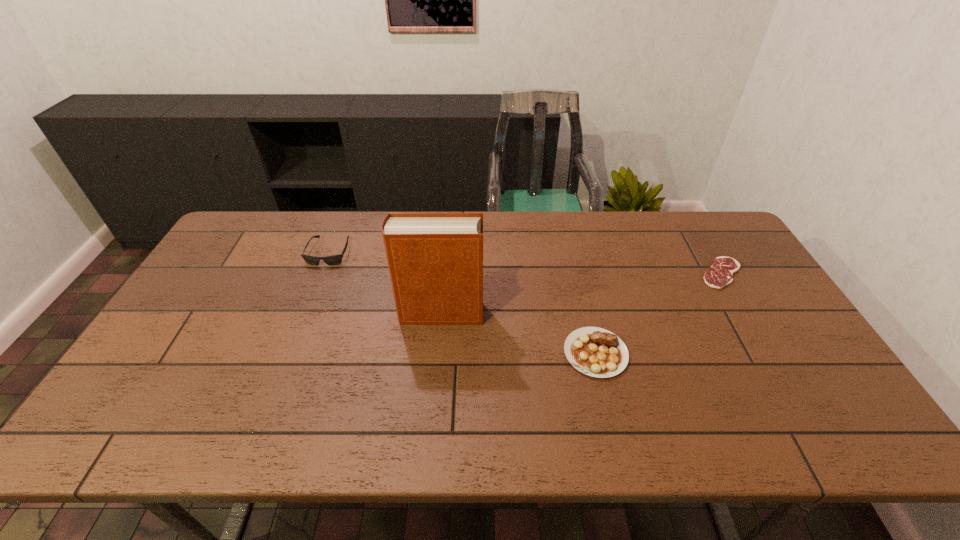
Find the location of a particular element. The height and width of the screenshot is (540, 960). free space located 0.100m on the front of the taller steak is located at coordinates (611, 417).

You are a GUI agent. You are given a task and a screenshot of the screen. Output one action in this format:
    pyautogui.click(x=<x>, y=<y>)
    Task: Click on the vacant area located 0.070m on the back of the shorter steak
    
    Given the screenshot: What is the action you would take?
    pyautogui.click(x=705, y=245)

You are a GUI agent. You are given a task and a screenshot of the screen. Output one action in this format:
    pyautogui.click(x=<x>, y=<y>)
    Task: Click on the object that is at the far edge
    Image resolution: width=960 pixels, height=540 pixels.
    Given the screenshot: What is the action you would take?
    (x=334, y=259)

Identify the location of object located in the right edge section of the desktop. This screenshot has width=960, height=540. (720, 274).

This screenshot has width=960, height=540. Identify the location of vacant space at the far edge. click(674, 240).

Identify the location of vacant space at the near edge of the desktop. The width and height of the screenshot is (960, 540). (771, 442).

Identify the location of blank space at the far right corner of the desktop. The image size is (960, 540). (691, 232).

Find the location of a particular element. This screenshot has height=540, width=960. free space between the rightmost object and the nearer steak is located at coordinates (659, 313).

The image size is (960, 540). I want to click on free space between the third farthest object and the second object from right to left, so click(x=518, y=333).

Where is `free spot between the third tallest object and the shorter steak`? This screenshot has width=960, height=540. free spot between the third tallest object and the shorter steak is located at coordinates (659, 313).